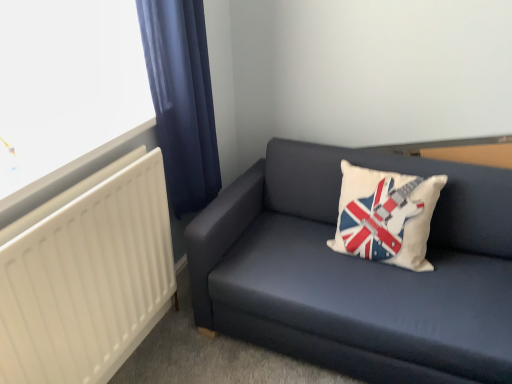
Question: From the image's perspective, is white matte radiator at left above or below white fabric pillow with union jack design at center?

Choices:
 (A) below
 (B) above

Answer: (A)

Question: In the image, is white matte radiator at left positioned in front of or behind white fabric pillow with union jack design at center?

Choices:
 (A) front
 (B) behind

Answer: (A)

Question: Which object is positioned farthest from the dark blue fabric couch at lower right?

Choices:
 (A) white fabric pillow with union jack design at center
 (B) dark blue fabric curtain at left
 (C) white matte radiator at left

Answer: (B)

Question: Based on their relative distances, which object is farther from the dark blue fabric curtain at left?

Choices:
 (A) dark blue fabric couch at lower right
 (B) white fabric pillow with union jack design at center
 (C) white matte radiator at left

Answer: (B)